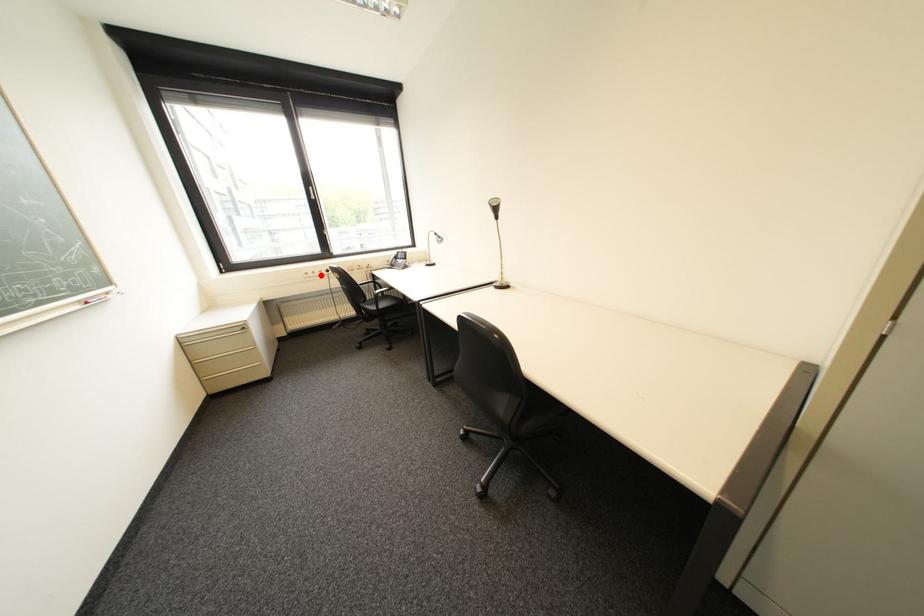
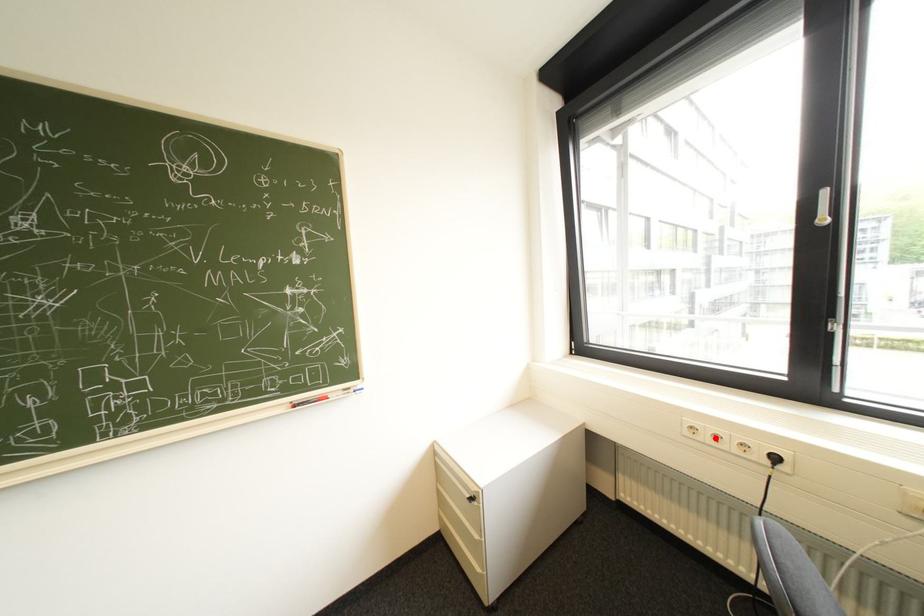
I am providing you with two images of the same scene from different viewpoints. A red point is marked on the first image and another point is marked on the second image. Is the red point in image1 aligned with the point shown in image2?

Yes